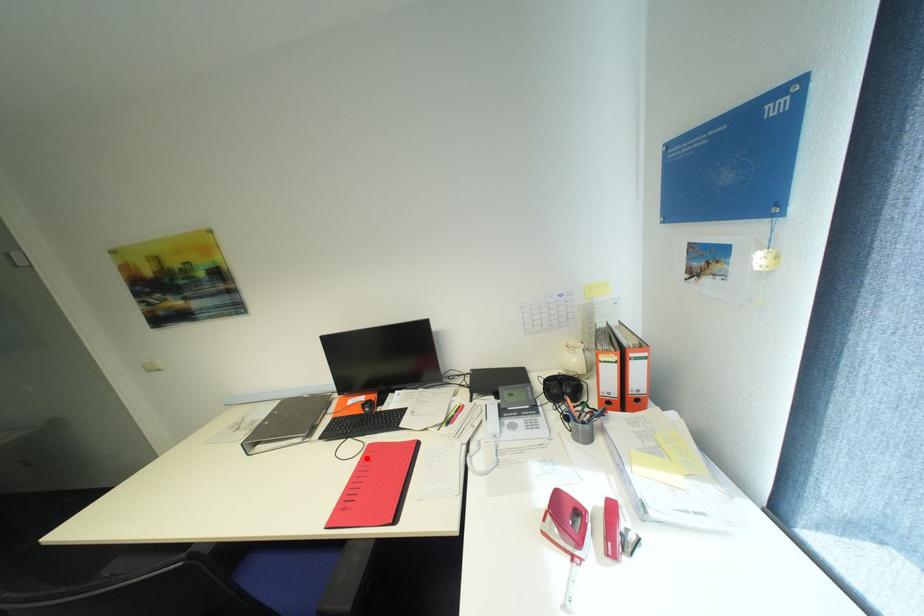
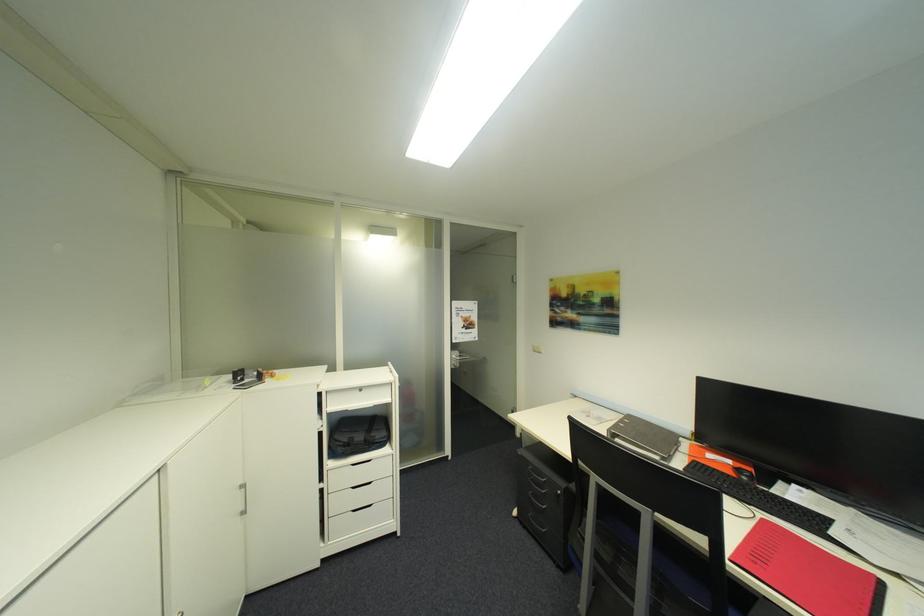
The point at the highlighted location is marked in the first image. Where is the corresponding point in the second image?

(760, 524)